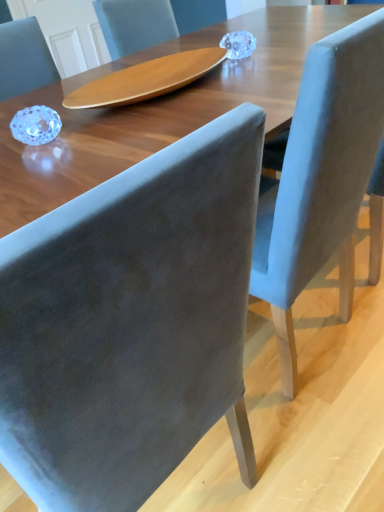
Question: Which direction should I rotate to look at velvet gray chair at center, which is the 2th chair in right-to-left order, — up or down?

Choices:
 (A) up
 (B) down

Answer: (B)

Question: Can you confirm if velvet blue chair at center, which ranks as the second chair in left-to-right order, is wider than velvet gray chair at center, the 1th chair from the left?

Choices:
 (A) no
 (B) yes

Answer: (A)

Question: Is velvet blue chair at center, marked as the 1th chair in a right-to-left arrangement, facing away from velvet gray chair at center, the 1th chair from the left?

Choices:
 (A) yes
 (B) no

Answer: (B)

Question: Can you confirm if velvet blue chair at center, marked as the 1th chair in a right-to-left arrangement, is thinner than velvet gray chair at center, which is the 2th chair in right-to-left order?

Choices:
 (A) yes
 (B) no

Answer: (A)

Question: Would you say velvet blue chair at center, marked as the 1th chair in a right-to-left arrangement, is outside velvet gray chair at center, which is the 2th chair in right-to-left order?

Choices:
 (A) no
 (B) yes

Answer: (B)

Question: Is velvet gray chair at center, the 1th chair from the left, completely or partially inside velvet blue chair at center, which ranks as the second chair in left-to-right order?

Choices:
 (A) no
 (B) yes

Answer: (A)

Question: From a real-world perspective, is velvet blue chair at center, which ranks as the second chair in left-to-right order, below velvet gray chair at center, the 1th chair from the left?

Choices:
 (A) no
 (B) yes

Answer: (B)

Question: Can you confirm if velvet gray chair at center, the 1th chair from the left, is positioned to the left of velvet blue chair at center, which ranks as the second chair in left-to-right order?

Choices:
 (A) no
 (B) yes

Answer: (B)

Question: Does velvet gray chair at center, the 1th chair from the left, have a lesser height compared to velvet blue chair at center, which ranks as the second chair in left-to-right order?

Choices:
 (A) no
 (B) yes

Answer: (A)

Question: Does velvet gray chair at center, which is the 2th chair in right-to-left order, have a greater width compared to velvet blue chair at center, which ranks as the second chair in left-to-right order?

Choices:
 (A) no
 (B) yes

Answer: (B)

Question: Is velvet gray chair at center, the 1th chair from the left, bigger than velvet blue chair at center, which ranks as the second chair in left-to-right order?

Choices:
 (A) no
 (B) yes

Answer: (A)

Question: Is velvet gray chair at center, the 1th chair from the left, surrounding velvet blue chair at center, which ranks as the second chair in left-to-right order?

Choices:
 (A) yes
 (B) no

Answer: (B)

Question: Is velvet gray chair at center, which is the 2th chair in right-to-left order, positioned with its back to velvet blue chair at center, marked as the 1th chair in a right-to-left arrangement?

Choices:
 (A) yes
 (B) no

Answer: (B)

Question: Is point (284, 216) positioned closer to the camera than point (183, 228)?

Choices:
 (A) farther
 (B) closer

Answer: (A)